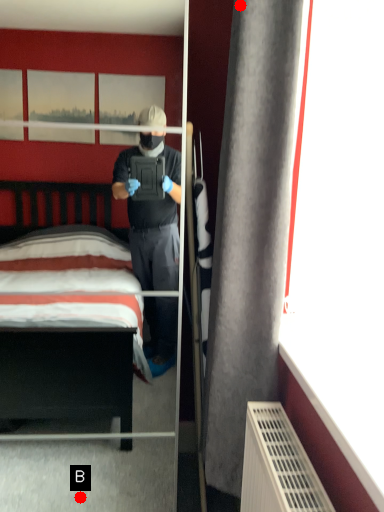
Question: Two points are circled on the image, labeled by A and B beside each circle. Which point appears closest to the camera in this image?

Choices:
 (A) A is closer
 (B) B is closer

Answer: (A)